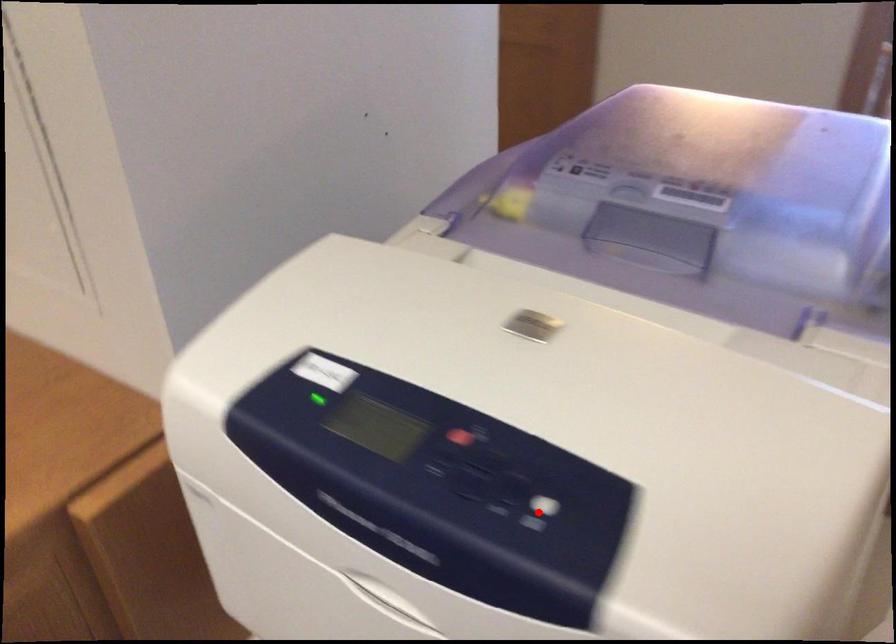
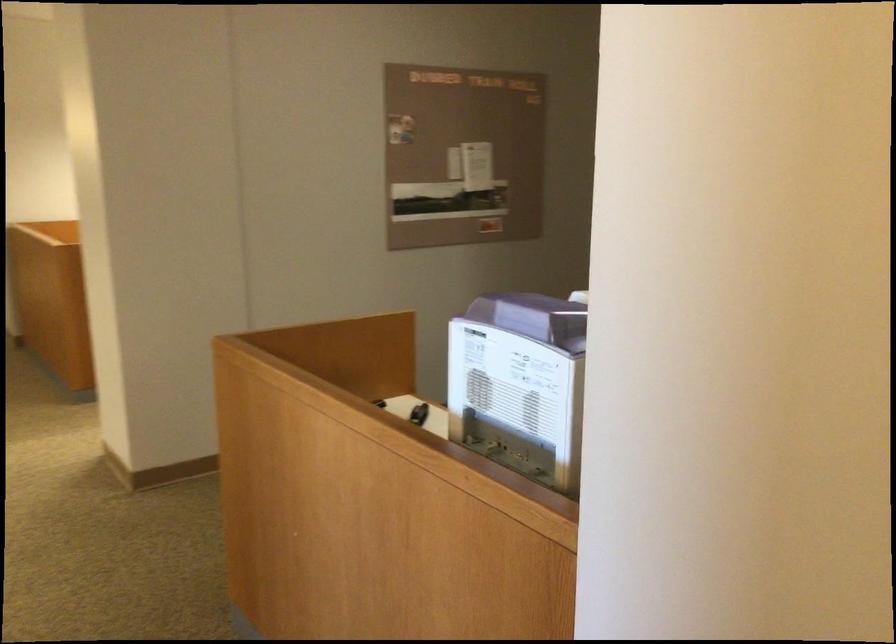
Question: I am providing you with two images of the same scene from different viewpoints. A red point is marked on the first image. Is the red point's position out of view in image 2?

Choices:
 (A) Yes
 (B) No

Answer: (A)